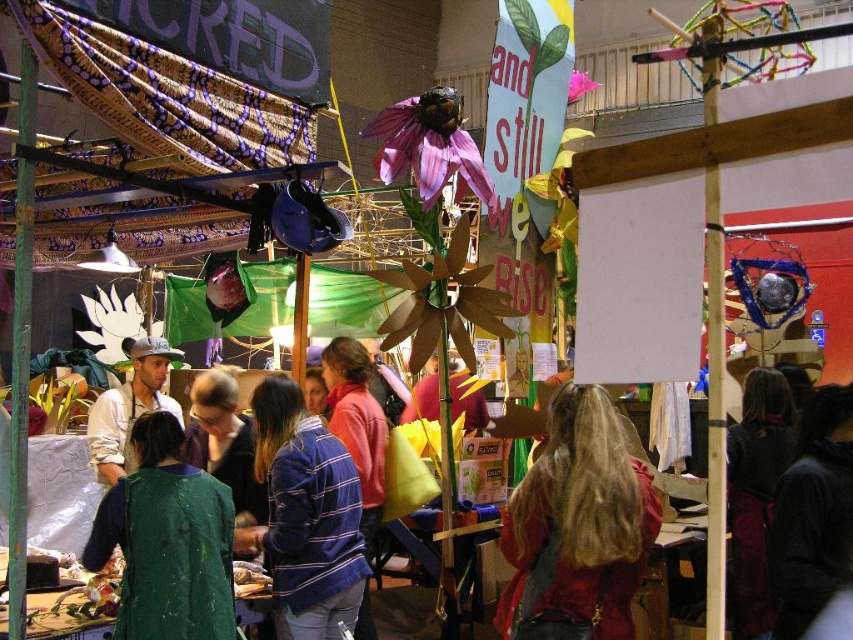
In the scene shown: Can you confirm if blonde hair at center is smaller than matte white cap at center?

Indeed, blonde hair at center has a smaller size compared to matte white cap at center.

Can you confirm if blonde hair at center is positioned above matte white cap at center?

Incorrect, blonde hair at center is not positioned above matte white cap at center.

Find the location of `blonde hair at center`. blonde hair at center is located at coordinates (577, 528).

Does blonde hair at center have a smaller size compared to striped fleece jacket at center?

Correct, blonde hair at center occupies less space than striped fleece jacket at center.

Does point (584, 600) come closer to viewer compared to point (281, 538)?

Yes.

Does point (567, 444) come closer to viewer compared to point (341, 614)?

That is True.

Where is `blonde hair at center`? The width and height of the screenshot is (853, 640). blonde hair at center is located at coordinates (577, 528).

Can you confirm if striped fleece jacket at center is positioned below matte white cap at center?

Yes.

This screenshot has height=640, width=853. Find the location of `striped fleece jacket at center`. striped fleece jacket at center is located at coordinates (305, 516).

Does point (277, 566) lie in front of point (106, 426)?

Yes, point (277, 566) is closer to viewer.

I want to click on striped fleece jacket at center, so click(x=305, y=516).